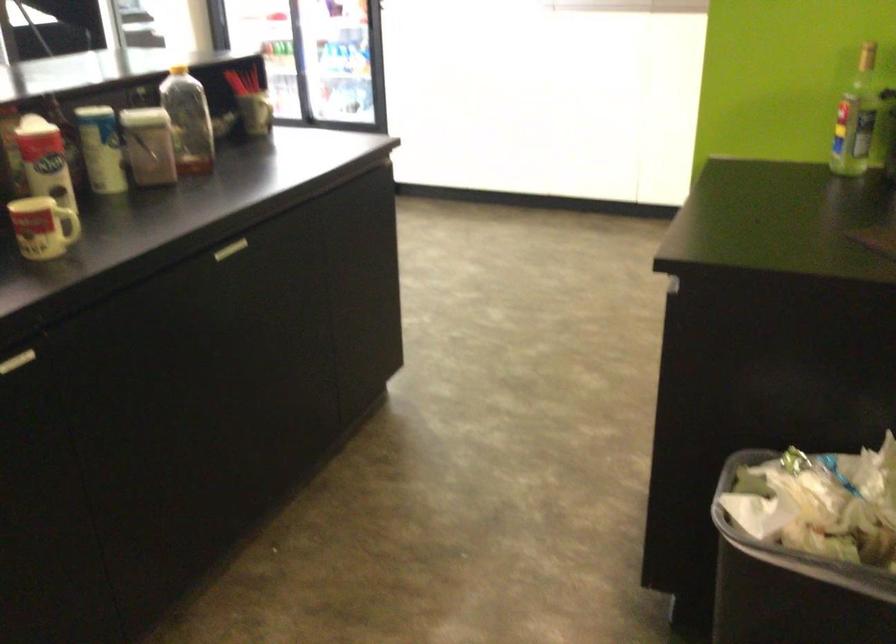
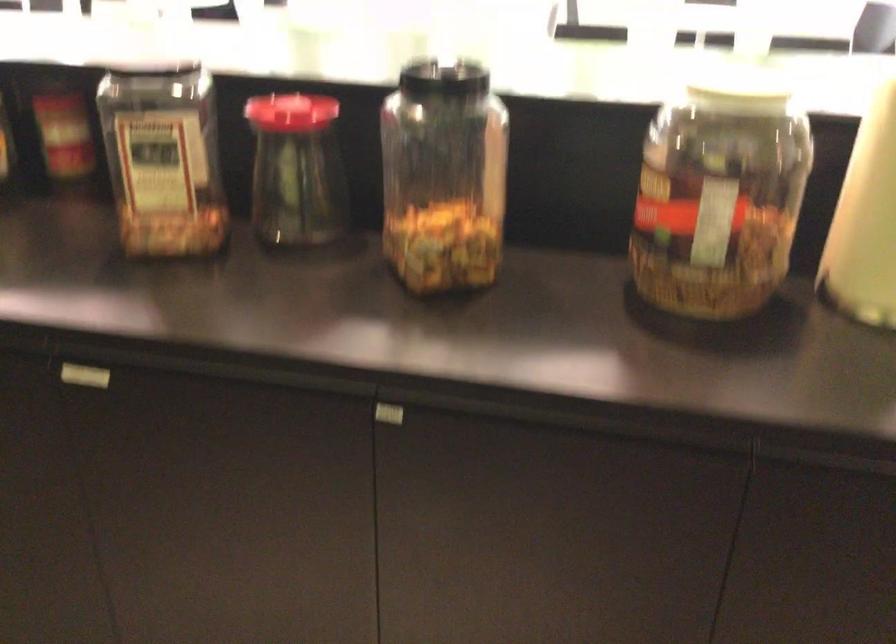
First-person continuous shooting, in which direction is the camera rotating?

The rotation direction of the camera is left-down.